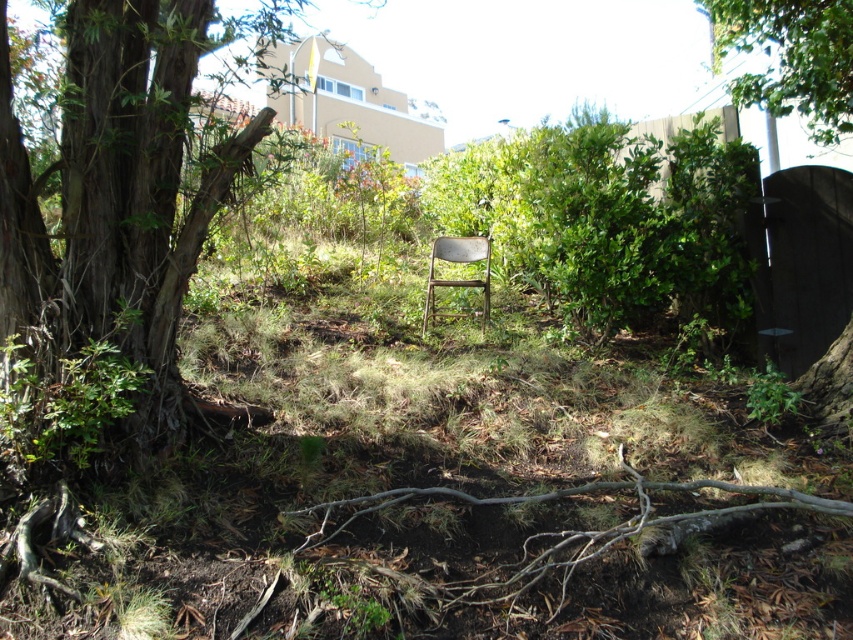
Is green leafy bush at center smaller than green leafy tree at upper right?

Actually, green leafy bush at center might be larger than green leafy tree at upper right.

Based on the photo, is green leafy bush at center taller than green leafy tree at upper right?

Correct, green leafy bush at center is much taller as green leafy tree at upper right.

Does point (549, 205) lie behind point (837, 19)?

Yes, point (549, 205) is farther from viewer.

Find the location of `green leafy bush at center`. green leafy bush at center is located at coordinates (611, 220).

Who is more forward, (149, 390) or (811, 116)?

Point (149, 390) is in front.

Can you confirm if green leafy tree at left is bigger than green leafy tree at upper right?

Incorrect, green leafy tree at left is not larger than green leafy tree at upper right.

Locate an element on the screen. The height and width of the screenshot is (640, 853). green leafy tree at left is located at coordinates (114, 196).

In order to click on green leafy tree at left in this screenshot , I will do `click(114, 196)`.

Can you confirm if green leafy tree at left is positioned to the left of metallic folding chair at center?

Correct, you'll find green leafy tree at left to the left of metallic folding chair at center.

Does green leafy tree at left lie behind metallic folding chair at center?

No, green leafy tree at left is closer to the viewer.

Is point (170, 321) farther from camera compared to point (480, 252)?

That is False.

Image resolution: width=853 pixels, height=640 pixels. Identify the location of green leafy tree at left. (114, 196).